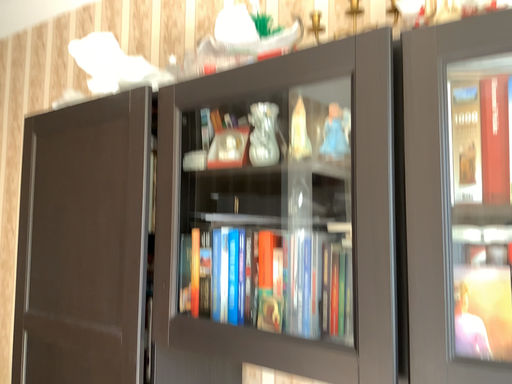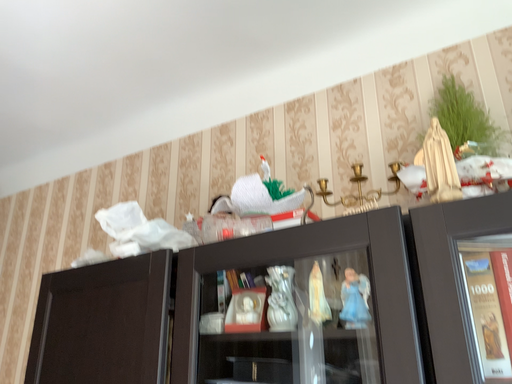
Question: How did the camera likely rotate when shooting the video?

Choices:
 (A) rotated upward
 (B) rotated downward

Answer: (A)